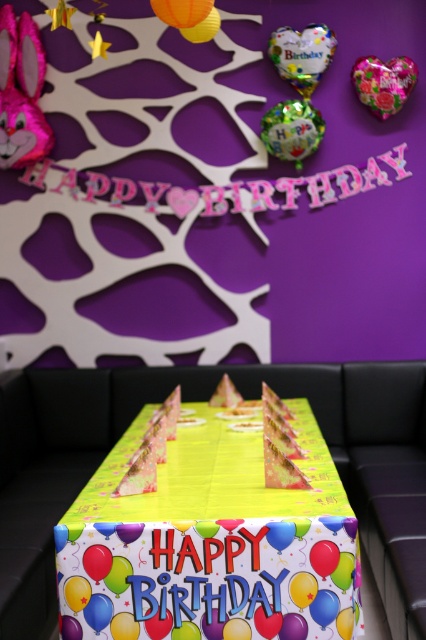
Who is higher up, yellow paper table at center or yellow paper cake at center?

Positioned higher is yellow paper cake at center.

Between yellow paper table at center and yellow paper cake at center, which one is positioned lower?

Result: Positioned lower is yellow paper table at center.

Who is more forward, (196, 412) or (278, 422)?

Positioned in front is point (278, 422).

This screenshot has height=640, width=426. I want to click on yellow paper table at center, so click(x=212, y=540).

Which is more to the left, yellow paper table at center or pink metallic heart at upper center?

From the viewer's perspective, yellow paper table at center appears more on the left side.

The height and width of the screenshot is (640, 426). What do you see at coordinates (212, 540) in the screenshot? I see `yellow paper table at center` at bounding box center [212, 540].

Find the location of a particular element. The image size is (426, 640). yellow paper table at center is located at coordinates (212, 540).

Between pink metallic heart at upper center and yellow paper cake at center, which one appears on the left side from the viewer's perspective?

From the viewer's perspective, yellow paper cake at center appears more on the left side.

Which is above, pink metallic heart at upper center or yellow paper cake at center?

pink metallic heart at upper center

Who is more distant from viewer, (x=371, y=100) or (x=261, y=403)?

Point (x=371, y=100)

What are the coordinates of `pink metallic heart at upper center` in the screenshot? It's located at (383, 83).